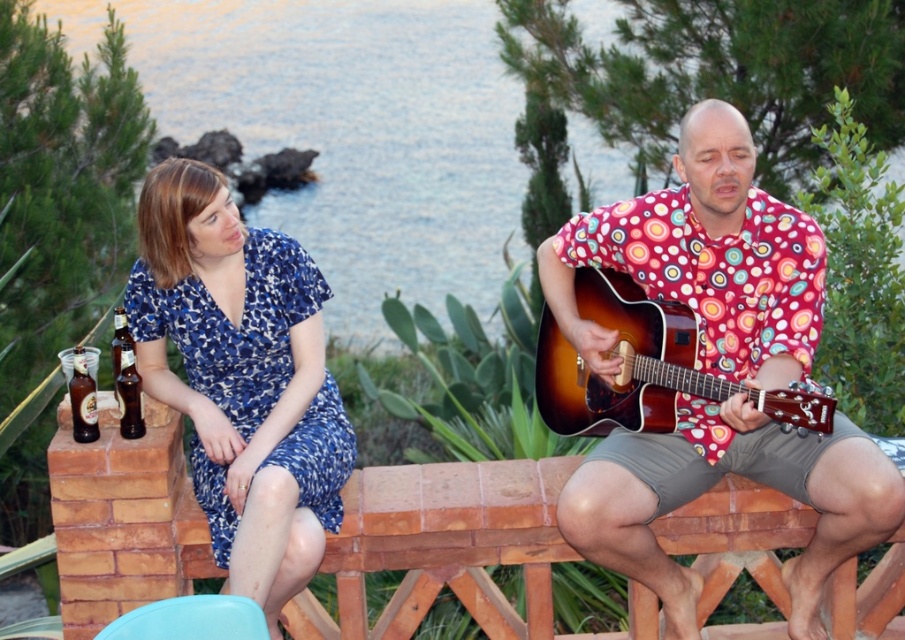
You are a photographer setting up a shoot at the seaside location described. You need to ensure that the matte red shirt at center and the satin wood guitar at right are both visible in the frame. Given their sizes, which object might require more space in the composition to be fully captured?

The matte red shirt at center is larger in size than the satin wood guitar at right, so it would require more space in the composition to be fully captured.